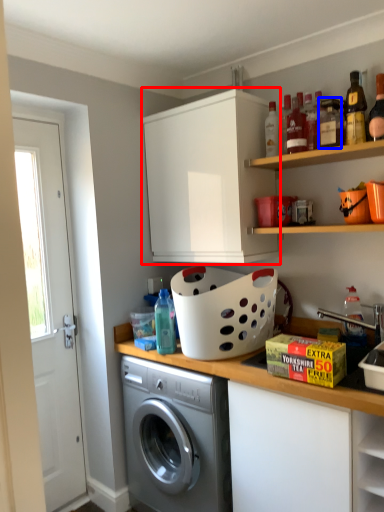
Question: Which object appears closest to the camera in this image, cabinetry (highlighted by a red box) or bottle (highlighted by a blue box)?

Choices:
 (A) cabinetry
 (B) bottle

Answer: (B)